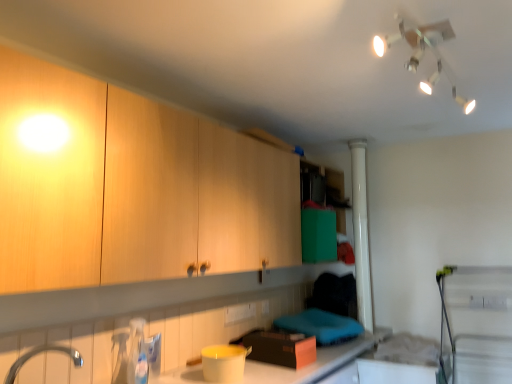
Where is `wooden cabinet at upper left`? wooden cabinet at upper left is located at coordinates (145, 194).

The height and width of the screenshot is (384, 512). Describe the element at coordinates (39, 353) in the screenshot. I see `silver metallic tap at lower left` at that location.

The height and width of the screenshot is (384, 512). What do you see at coordinates (424, 53) in the screenshot?
I see `white plastic light fixture at upper center` at bounding box center [424, 53].

Where is `wooden cabinet at upper left`? wooden cabinet at upper left is located at coordinates (145, 194).

Looking at this image, looking at their sizes, would you say silver metallic tap at lower left is wider or thinner than wooden cabinet at upper left?

Clearly, silver metallic tap at lower left has less width compared to wooden cabinet at upper left.

Considering the positions of point (79, 366) and point (200, 143), is point (79, 366) closer or farther from the camera than point (200, 143)?

Point (79, 366) is positioned closer to the camera compared to point (200, 143).

Considering the relative sizes of silver metallic tap at lower left and wooden cabinet at upper left in the image provided, is silver metallic tap at lower left bigger than wooden cabinet at upper left?

No.

From the image's perspective, which one is positioned higher, silver metallic tap at lower left or wooden cabinet at upper left?

wooden cabinet at upper left appears higher in the image.

Which is more to the right, white plastic light fixture at upper center or silver metallic tap at lower left?

white plastic light fixture at upper center is more to the right.

Is point (438, 73) behind point (73, 362)?

Yes, point (438, 73) is farther from viewer.

Considering the sizes of white plastic light fixture at upper center and silver metallic tap at lower left in the image, is white plastic light fixture at upper center taller or shorter than silver metallic tap at lower left?

In the image, white plastic light fixture at upper center appears to be shorter than silver metallic tap at lower left.

Is white plastic light fixture at upper center aimed at silver metallic tap at lower left?

No, white plastic light fixture at upper center is not oriented towards silver metallic tap at lower left.

How much distance is there between matte plastic container at lower center and white plastic light fixture at upper center?

matte plastic container at lower center is 5.11 feet away from white plastic light fixture at upper center.

Based on the photo, do you think matte plastic container at lower center is within white plastic light fixture at upper center, or outside of it?

matte plastic container at lower center is outside white plastic light fixture at upper center.

Considering the relative sizes of matte plastic container at lower center and white plastic light fixture at upper center in the image provided, is matte plastic container at lower center wider than white plastic light fixture at upper center?

Incorrect, the width of matte plastic container at lower center does not surpass that of white plastic light fixture at upper center.

Is matte plastic container at lower center in front of or behind white plastic light fixture at upper center in the image?

matte plastic container at lower center is positioned farther from the viewer than white plastic light fixture at upper center.

Is white plastic light fixture at upper center next to wooden cabinet at upper left and touching it?

white plastic light fixture at upper center and wooden cabinet at upper left are not in contact.

From the image's perspective, which one is positioned higher, white plastic light fixture at upper center or wooden cabinet at upper left?

white plastic light fixture at upper center.

Is white plastic light fixture at upper center to the right of wooden cabinet at upper left from the viewer's perspective?

Yes.

Can we say white plastic light fixture at upper center lies outside wooden cabinet at upper left?

white plastic light fixture at upper center is positioned outside wooden cabinet at upper left.

From the image's perspective, who appears lower, white plastic light fixture at upper center or matte plastic container at lower center?

matte plastic container at lower center is shown below in the image.

Which is closer to the camera, (387, 37) or (325, 348)?

The point (387, 37) is closer to the camera.

Does white plastic light fixture at upper center have a greater height compared to matte plastic container at lower center?

In fact, white plastic light fixture at upper center may be shorter than matte plastic container at lower center.

What's the angular difference between white plastic light fixture at upper center and matte plastic container at lower center's facing directions?

91.8 degrees.

Which object is thinner, silver metallic tap at lower left or matte plastic container at lower center?

silver metallic tap at lower left.

Is silver metallic tap at lower left inside or outside of matte plastic container at lower center?

silver metallic tap at lower left lies outside matte plastic container at lower center.

Is silver metallic tap at lower left bigger than matte plastic container at lower center?

No.

Does wooden cabinet at upper left appear on the left side of silver metallic tap at lower left?

No, wooden cabinet at upper left is not to the left of silver metallic tap at lower left.

Considering the sizes of objects wooden cabinet at upper left and silver metallic tap at lower left in the image provided, who is taller, wooden cabinet at upper left or silver metallic tap at lower left?

Standing taller between the two is wooden cabinet at upper left.

Choose the correct answer: Is wooden cabinet at upper left inside silver metallic tap at lower left or outside it?

wooden cabinet at upper left is outside silver metallic tap at lower left.

Is point (237, 198) positioned before point (20, 359)?

No, it is behind (20, 359).

Locate an element on the screen. tap behind the wooden cabinet at upper left is located at coordinates (39, 353).

In the image, there is a silver metallic tap at lower left. Where is `light fixture above it (from the image's perspective)`? light fixture above it (from the image's perspective) is located at coordinates (424, 53).

Looking at the image, which one is located further to wooden cabinet at upper left, matte plastic container at lower center or silver metallic tap at lower left?

Based on the image, matte plastic container at lower center appears to be further to wooden cabinet at upper left.

When comparing their distances from matte plastic container at lower center, does silver metallic tap at lower left or white plastic light fixture at upper center seem closer?

silver metallic tap at lower left.

When comparing their distances from silver metallic tap at lower left, does matte plastic container at lower center or white plastic light fixture at upper center seem closer?

matte plastic container at lower center is closer to silver metallic tap at lower left.

Considering their positions, is wooden cabinet at upper left positioned closer to white plastic light fixture at upper center than silver metallic tap at lower left?

wooden cabinet at upper left is positioned closer to the anchor white plastic light fixture at upper center.

Looking at the image, which one is located closer to wooden cabinet at upper left, white plastic light fixture at upper center or silver metallic tap at lower left?

silver metallic tap at lower left is closer to wooden cabinet at upper left.

When comparing their distances from silver metallic tap at lower left, does white plastic light fixture at upper center or matte plastic container at lower center seem further?

The object further to silver metallic tap at lower left is white plastic light fixture at upper center.

When comparing their distances from matte plastic container at lower center, does silver metallic tap at lower left or wooden cabinet at upper left seem closer?

wooden cabinet at upper left lies closer to matte plastic container at lower center than the other object.

Which object lies nearer to the anchor point white plastic light fixture at upper center, matte plastic container at lower center or silver metallic tap at lower left?

matte plastic container at lower center lies closer to white plastic light fixture at upper center than the other object.

Where is `tap between wooden cabinet at upper left and matte plastic container at lower center in the vertical direction`? The width and height of the screenshot is (512, 384). tap between wooden cabinet at upper left and matte plastic container at lower center in the vertical direction is located at coordinates (39, 353).

You are a GUI agent. You are given a task and a screenshot of the screen. Output one action in this format:
    pyautogui.click(x=<x>, y=<y>)
    Task: Click on the tap between white plastic light fixture at upper center and matte plastic container at lower center in the up-down direction
    This screenshot has width=512, height=384.
    Given the screenshot: What is the action you would take?
    pyautogui.click(x=39, y=353)

In order to click on cabinetry between silver metallic tap at lower left and white plastic light fixture at upper center in this screenshot , I will do [x=145, y=194].

Find the location of `cabinetry between white plastic light fixture at upper center and matte plastic container at lower center in the up-down direction`. cabinetry between white plastic light fixture at upper center and matte plastic container at lower center in the up-down direction is located at coordinates (145, 194).